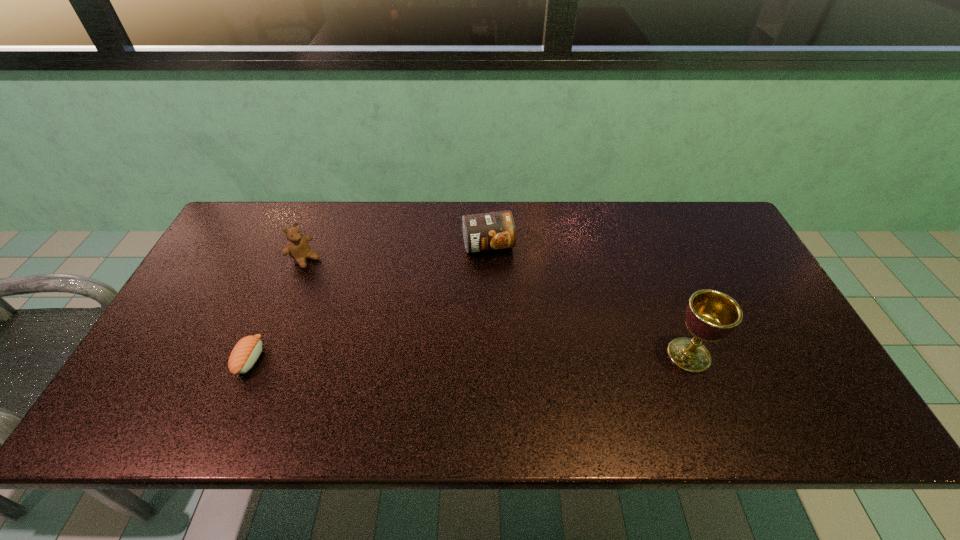
At what (x,y) coordinates should I click in order to perform the action: click on free space between the can and the rightmost object. Please return your answer as a coordinate pair (x, y). Looking at the image, I should click on pos(588,300).

The height and width of the screenshot is (540, 960). I want to click on free area in between the second object from right to left and the rightmost object, so click(588, 300).

You are a GUI agent. You are given a task and a screenshot of the screen. Output one action in this format:
    pyautogui.click(x=<x>, y=<y>)
    Task: Click on the vacant space in between the rightmost object and the teddy bear
    This screenshot has height=540, width=960.
    Given the screenshot: What is the action you would take?
    pyautogui.click(x=497, y=307)

Locate an element on the screen. The image size is (960, 540). object that is the third closest to the teddy bear is located at coordinates (711, 315).

Point out which object is positioned as the third nearest to the rightmost object. Please provide its 2D coordinates. Your answer should be formatted as a tuple, i.e. [(x, y)], where the tuple contains the x and y coordinates of a point satisfying the conditions above.

[(245, 353)]

Where is `vacant space that satisfies the following two spatial constraints: 1. on the front side of the rightmost object; 2. on the left side of the third object from left to right`? This screenshot has height=540, width=960. vacant space that satisfies the following two spatial constraints: 1. on the front side of the rightmost object; 2. on the left side of the third object from left to right is located at coordinates (491, 355).

Identify the location of free region that satisfies the following two spatial constraints: 1. on the back side of the second object from right to left; 2. on the right side of the sushi. This screenshot has width=960, height=540. (299, 245).

At what (x,y) coordinates should I click in order to perform the action: click on free spot that satisfies the following two spatial constraints: 1. on the front side of the chalice; 2. on the left side of the can. Please return your answer as a coordinate pair (x, y). Looking at the image, I should click on (491, 355).